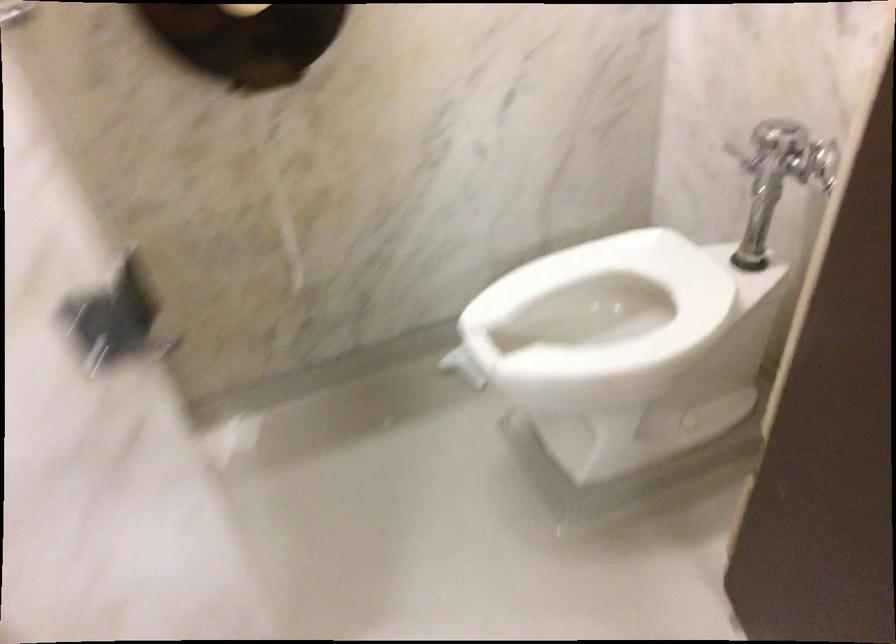
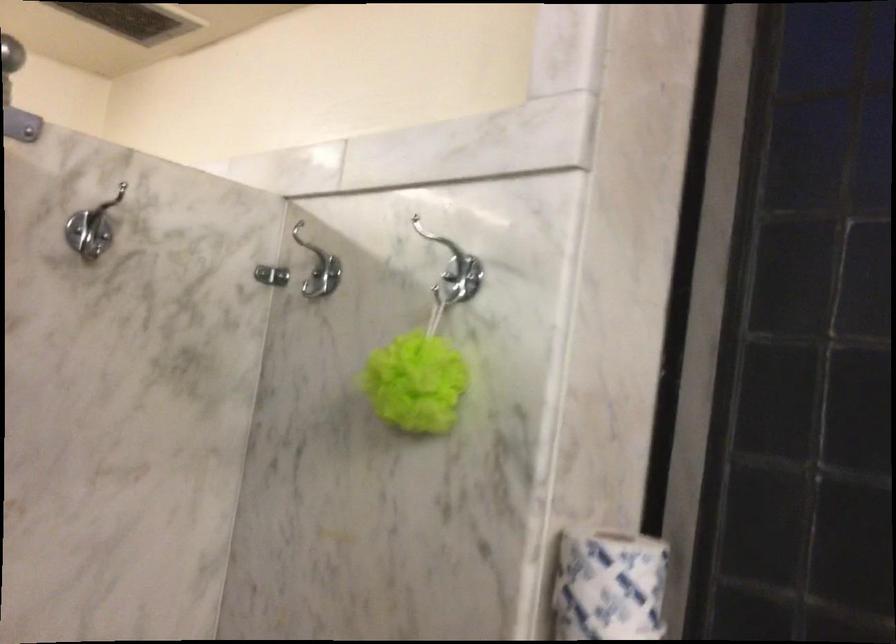
Consider the image. The first image is from the beginning of the video and the second image is from the end. How did the camera likely rotate when shooting the video?

The rotation direction of the camera is right-up.